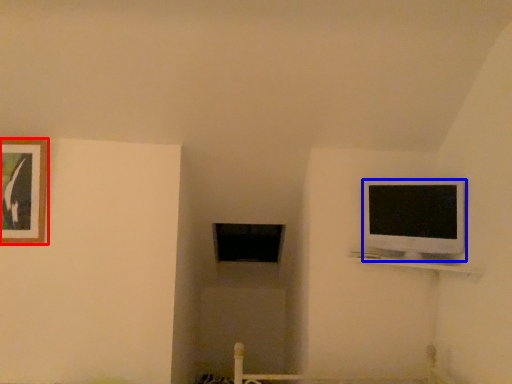
Question: Among these objects, which one is nearest to the camera, picture frame (highlighted by a red box) or television (highlighted by a blue box)?

Choices:
 (A) picture frame
 (B) television

Answer: (B)